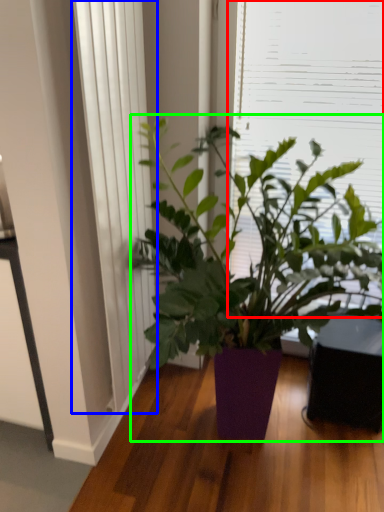
Question: Which object is positioned farthest from window screen (highlighted by a red box)? Select from curtain (highlighted by a blue box) and houseplant (highlighted by a green box).

Choices:
 (A) curtain
 (B) houseplant

Answer: (A)